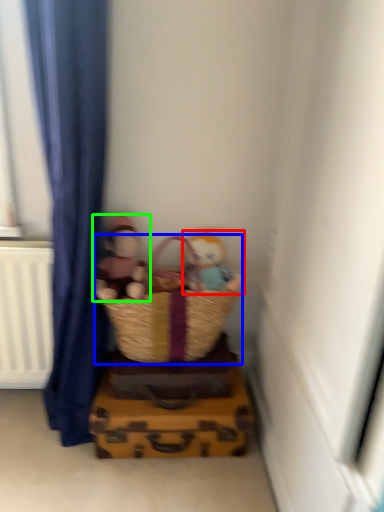
Question: Based on their relative distances, which object is nearer to person (highlighted by a red box)? Choose from picnic basket (highlighted by a blue box) and person (highlighted by a green box).

Choices:
 (A) picnic basket
 (B) person

Answer: (A)